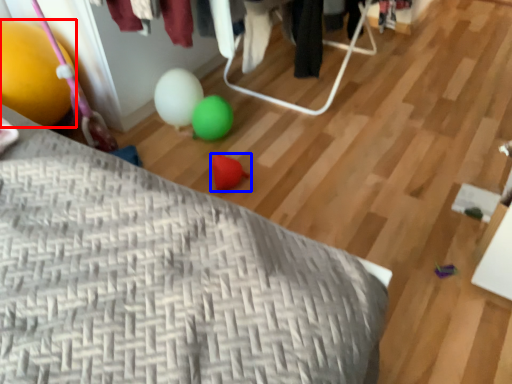
Question: Which object appears closest to the camera in this image, balloon (highlighted by a red box) or toy (highlighted by a blue box)?

Choices:
 (A) balloon
 (B) toy

Answer: (A)